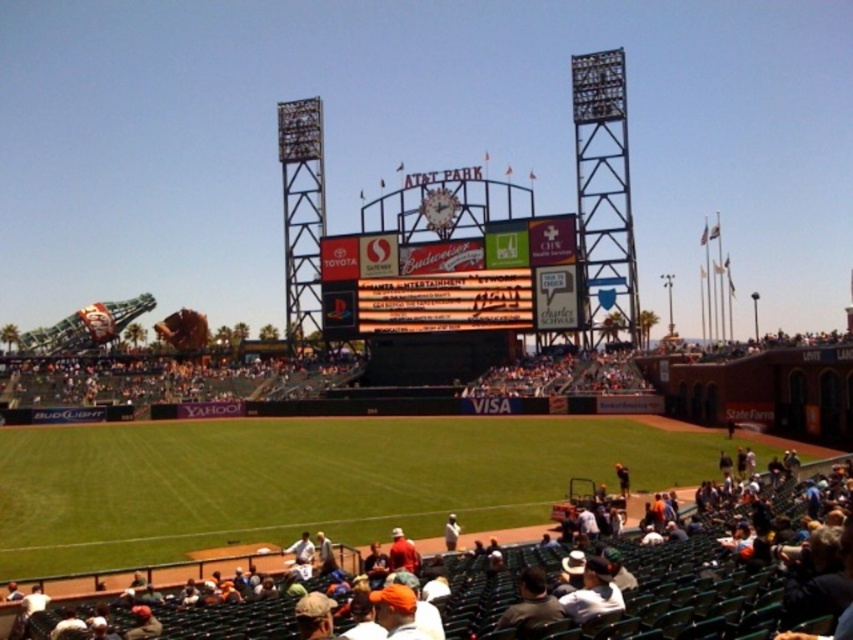
Question: Which is nearer to the multicolored digital display at center?

Choices:
 (A) orange fabric cap at lower center
 (B) white jersey at center
 (C) dark gray shirt at lower center
 (D) white cotton cap at lower center

Answer: (B)

Question: Observing the image, what is the correct spatial positioning of multicolored digital display at center in reference to white cotton cap at lower center?

Choices:
 (A) below
 (B) above

Answer: (B)

Question: Which of the following is the closest to the observer?

Choices:
 (A) multicolored digital display at center
 (B) white jersey at center

Answer: (B)

Question: Does dark gray shirt at lower center appear on the left side of white jersey at center?

Choices:
 (A) yes
 (B) no

Answer: (B)

Question: Among these points, which one is farthest from the camera?

Choices:
 (A) (392, 538)
 (B) (497, 627)

Answer: (A)

Question: Does orange fabric cap at lower center appear over white jersey at center?

Choices:
 (A) no
 (B) yes

Answer: (A)